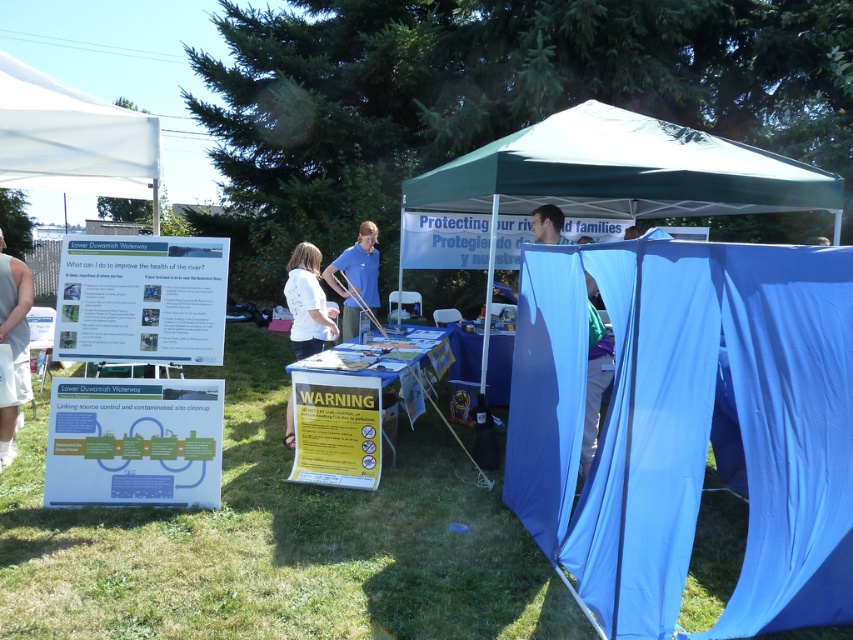
This screenshot has height=640, width=853. What do you see at coordinates (689, 426) in the screenshot?
I see `blue fabric tent at center` at bounding box center [689, 426].

Locate an element on the screen. The width and height of the screenshot is (853, 640). blue fabric tent at center is located at coordinates (689, 426).

I want to click on blue fabric tent at center, so click(689, 426).

Which is behind, point (769, 508) or point (10, 330)?

Positioned behind is point (10, 330).

You are a GUI agent. You are given a task and a screenshot of the screen. Output one action in this format:
    pyautogui.click(x=<x>, y=<y>)
    Task: Click on the blue fabric tent at center
    
    Given the screenshot: What is the action you would take?
    pyautogui.click(x=689, y=426)

Which of these two, white fabric canopy at upper left or white matte shirt at center, stands taller?

With more height is white matte shirt at center.

Between white fabric canopy at upper left and white matte shirt at center, which one has less height?

white fabric canopy at upper left is shorter.

In order to click on white fabric canopy at upper left in this screenshot , I will do `click(71, 138)`.

You are a GUI agent. You are given a task and a screenshot of the screen. Output one action in this format:
    pyautogui.click(x=<x>, y=<y>)
    Task: Click on the white fabric canopy at upper left
    Image resolution: width=853 pixels, height=640 pixels.
    Given the screenshot: What is the action you would take?
    pyautogui.click(x=71, y=138)